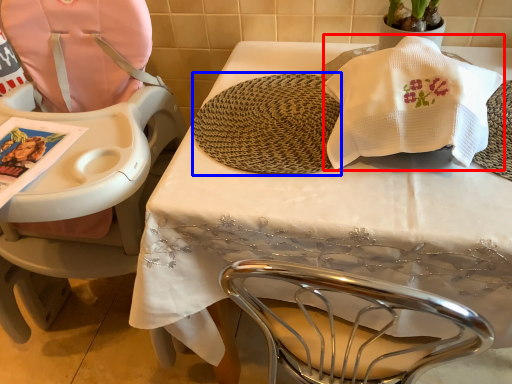
Question: Which object is closer to the camera taking this photo, blanket (highlighted by a red box) or mat (highlighted by a blue box)?

Choices:
 (A) blanket
 (B) mat

Answer: (A)